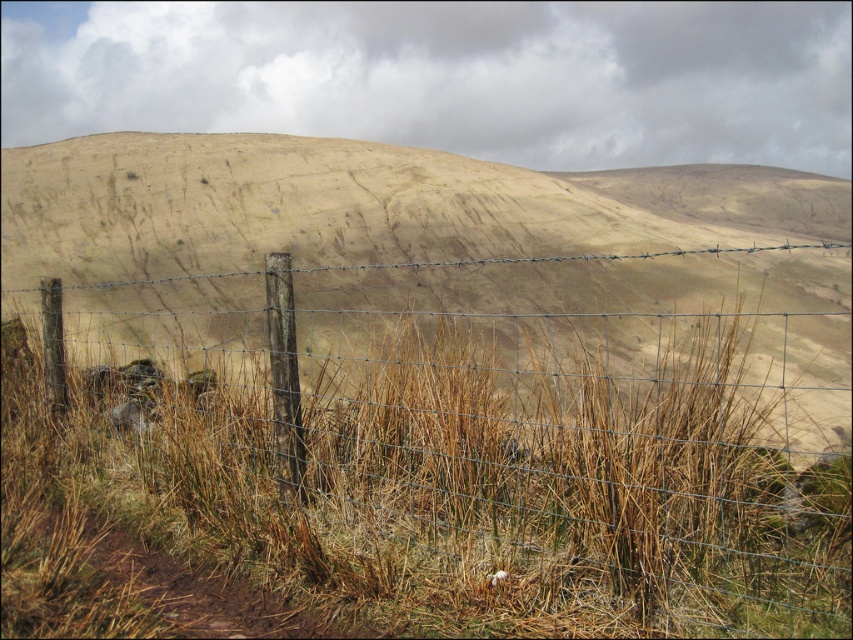
Question: Is wire mesh fence at center positioned at the back of dried grass at center?

Choices:
 (A) yes
 (B) no

Answer: (B)

Question: Which of the following is the farthest from the observer?

Choices:
 (A) dried grass at center
 (B) wire mesh fence at center

Answer: (A)

Question: Which point is farther to the camera?

Choices:
 (A) wire mesh fence at center
 (B) dried grass at center

Answer: (B)

Question: Which point appears closest to the camera in this image?

Choices:
 (A) (306, 344)
 (B) (125, 317)

Answer: (B)

Question: Considering the relative positions of wire mesh fence at center and dried grass at center in the image provided, where is wire mesh fence at center located with respect to dried grass at center?

Choices:
 (A) above
 (B) below

Answer: (B)

Question: Does wire mesh fence at center have a larger size compared to dried grass at center?

Choices:
 (A) no
 (B) yes

Answer: (A)